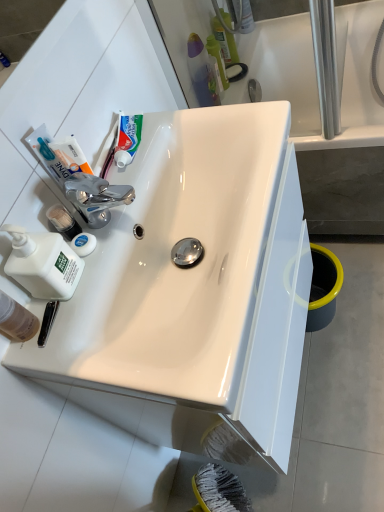
What do you see at coordinates (319, 115) in the screenshot?
I see `white glossy bathtub at upper right` at bounding box center [319, 115].

The image size is (384, 512). What do you see at coordinates (16, 319) in the screenshot?
I see `translucent plastic mouthwash at lower left` at bounding box center [16, 319].

You are a GUI agent. You are given a task and a screenshot of the screen. Output one action in this format:
    pyautogui.click(x=<x>, y=<y>)
    Task: Click on the translucent plastic mouthwash at lower left
    The width and height of the screenshot is (384, 512).
    Given the screenshot: What is the action you would take?
    pyautogui.click(x=16, y=319)

What do you see at coordinates (127, 138) in the screenshot? This screenshot has width=384, height=512. I see `green matte toothpaste at upper center` at bounding box center [127, 138].

Locate an element on the screen. translucent plastic toothbrush at upper center is located at coordinates point(217,59).

The image size is (384, 512). Identify the location of white glossy bathtub at upper right. (319, 115).

Does point (45, 255) come farther from viewer compared to point (13, 322)?

No.

Are white matte liquid soap at left and translucent plastic mouthwash at lower left located far from each other?

No, white matte liquid soap at left is in close proximity to translucent plastic mouthwash at lower left.

Considering the relative positions of white matte liquid soap at left and translucent plastic mouthwash at lower left in the image provided, is white matte liquid soap at left behind translucent plastic mouthwash at lower left?

Yes, white matte liquid soap at left is further from the viewer.

From the image's perspective, which is below, white matte liquid soap at left or translucent plastic mouthwash at lower left?

translucent plastic mouthwash at lower left, from the image's perspective.

Which object is more forward, translucent plastic toothbrush at upper center or white matte liquid soap at left?

Positioned in front is white matte liquid soap at left.

Find the location of a particular element. cleaning product positioned vertically above the translucent plastic toothbrush at upper center (from a real-world perspective) is located at coordinates (43, 264).

Would you say translucent plastic toothbrush at upper center is inside or outside white matte liquid soap at left?

translucent plastic toothbrush at upper center is located beyond the bounds of white matte liquid soap at left.

Looking at this image, from a real-world perspective, does translucent plastic toothbrush at upper center stand above white matte liquid soap at left?

Actually, translucent plastic toothbrush at upper center is physically below white matte liquid soap at left in the real world.

Is green matte toothpaste at upper center to the left of white matte liquid soap at left from the viewer's perspective?

In fact, green matte toothpaste at upper center is to the right of white matte liquid soap at left.

Would you say white matte liquid soap at left is part of green matte toothpaste at upper center's contents?

Definitely not — white matte liquid soap at left is not inside green matte toothpaste at upper center.

How different are the orientations of green matte toothpaste at upper center and white matte liquid soap at left in degrees?

They differ by 9.57 degrees in their facing directions.

Are green matte toothpaste at upper center and white matte liquid soap at left located far from each other?

No, green matte toothpaste at upper center is not far from white matte liquid soap at left.

From the image's perspective, which object appears higher, white glossy sink at center or translucent plastic toothbrush at upper center?

translucent plastic toothbrush at upper center, from the image's perspective.

Is white glossy sink at center oriented towards translucent plastic toothbrush at upper center?

No, white glossy sink at center does not turn towards translucent plastic toothbrush at upper center.

Is white glossy sink at center completely or partially outside of translucent plastic toothbrush at upper center?

Yes, white glossy sink at center is located beyond the bounds of translucent plastic toothbrush at upper center.

Which is behind, point (221, 174) or point (220, 52)?

The point (220, 52) is farther.

This screenshot has width=384, height=512. Find the location of `bath below the white glossy sink at center (from a real-world perspective)`. bath below the white glossy sink at center (from a real-world perspective) is located at coordinates (319, 115).

Would you say white glossy sink at center is outside white glossy bathtub at upper right?

white glossy sink at center is positioned outside white glossy bathtub at upper right.

Is white glossy sink at center directly adjacent to white glossy bathtub at upper right?

No, white glossy sink at center is not beside white glossy bathtub at upper right.

Can you confirm if white glossy sink at center is shorter than white glossy bathtub at upper right?

Indeed, white glossy sink at center has a lesser height compared to white glossy bathtub at upper right.

Is translucent plastic mouthwash at lower left further to camera compared to white glossy bathtub at upper right?

No, it is not.

Is translucent plastic mouthwash at lower left far away from white glossy bathtub at upper right?

translucent plastic mouthwash at lower left is far away from white glossy bathtub at upper right.

Between point (30, 330) and point (242, 42), which one is positioned behind?

The point (242, 42) is more distant.

Which object is wider, translucent plastic mouthwash at lower left or white glossy bathtub at upper right?

With larger width is white glossy bathtub at upper right.

Is translucent plastic mouthwash at lower left facing towards white matte liquid soap at left?

No, translucent plastic mouthwash at lower left is not turned towards white matte liquid soap at left.

Who is bigger, translucent plastic mouthwash at lower left or white matte liquid soap at left?

Bigger between the two is white matte liquid soap at left.

Considering the points (33, 317) and (47, 253), which point is in front, point (33, 317) or point (47, 253)?

Positioned in front is point (47, 253).

Based on the photo, is translucent plastic mouthwash at lower left inside or outside of white matte liquid soap at left?

translucent plastic mouthwash at lower left is not enclosed by white matte liquid soap at left.

I want to click on mouthwash in front of the white matte liquid soap at left, so click(x=16, y=319).

Locate an element on the screen. cleaning product located below the translucent plastic toothbrush at upper center (from the image's perspective) is located at coordinates (43, 264).

Consider the image. From the image, which object appears to be nearer to translucent plastic toothbrush at upper center, white matte liquid soap at left or white glossy bathtub at upper right?

Among the two, white glossy bathtub at upper right is located nearer to translucent plastic toothbrush at upper center.

Considering their positions, is translucent plastic toothbrush at upper center positioned further to white glossy sink at center than translucent plastic mouthwash at lower left?

The object further to white glossy sink at center is translucent plastic toothbrush at upper center.

Based on their spatial positions, is white matte liquid soap at left or white glossy bathtub at upper right closer to white glossy sink at center?

Based on the image, white matte liquid soap at left appears to be nearer to white glossy sink at center.

From the image, which object appears to be nearer to white matte liquid soap at left, green matte toothpaste at upper center or white glossy bathtub at upper right?

green matte toothpaste at upper center lies closer to white matte liquid soap at left than the other object.

From the image, which object appears to be farther from white matte liquid soap at left, translucent plastic mouthwash at lower left or green matte toothpaste at upper center?

green matte toothpaste at upper center lies further to white matte liquid soap at left than the other object.

Which object lies nearer to the anchor point translucent plastic toothbrush at upper center, translucent plastic mouthwash at lower left or green matte toothpaste at upper center?

green matte toothpaste at upper center is positioned closer to the anchor translucent plastic toothbrush at upper center.

Considering their positions, is white glossy sink at center positioned closer to translucent plastic toothbrush at upper center than translucent plastic mouthwash at lower left?

white glossy sink at center is positioned closer to the anchor translucent plastic toothbrush at upper center.

Looking at the image, which one is located further to translucent plastic toothbrush at upper center, green matte toothpaste at upper center or white glossy bathtub at upper right?

Among the two, green matte toothpaste at upper center is located further to translucent plastic toothbrush at upper center.

The height and width of the screenshot is (512, 384). In order to click on cleaning product between translucent plastic mouthwash at lower left and white glossy sink at center in the horizontal direction in this screenshot , I will do `click(43, 264)`.

Where is `toothpaste between translucent plastic mouthwash at lower left and translucent plastic toothbrush at upper center along the z-axis`? toothpaste between translucent plastic mouthwash at lower left and translucent plastic toothbrush at upper center along the z-axis is located at coordinates (127, 138).

This screenshot has width=384, height=512. Identify the location of bath located between white glossy sink at center and translucent plastic toothbrush at upper center in the depth direction. (319, 115).

Where is `mouthwash between white glossy sink at center and translucent plastic toothbrush at upper center along the z-axis`? mouthwash between white glossy sink at center and translucent plastic toothbrush at upper center along the z-axis is located at coordinates (16, 319).